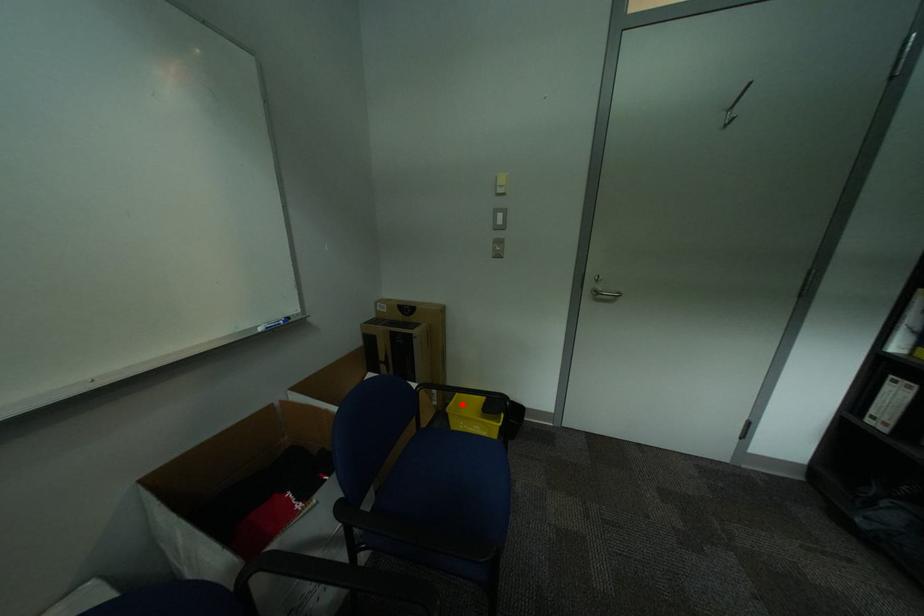
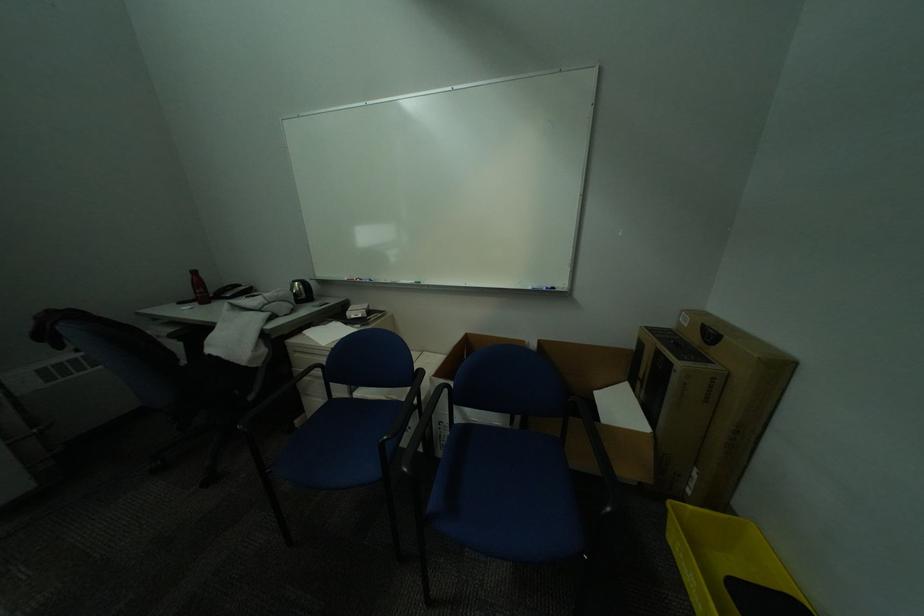
Question: A red point is marked in image1. In image2, is the corresponding 3D point closer to the camera or farther? Reply with the corresponding letter.

Choices:
 (A) The corresponding 3D point is closer.
 (B) The corresponding 3D point is farther.

Answer: (A)